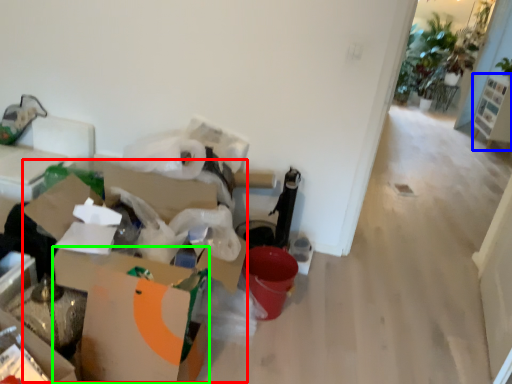
Question: Based on their relative distances, which object is farther from cardboard box (highlighted by a red box)? Choose from furniture (highlighted by a blue box) and cardboard box (highlighted by a green box).

Choices:
 (A) furniture
 (B) cardboard box

Answer: (A)